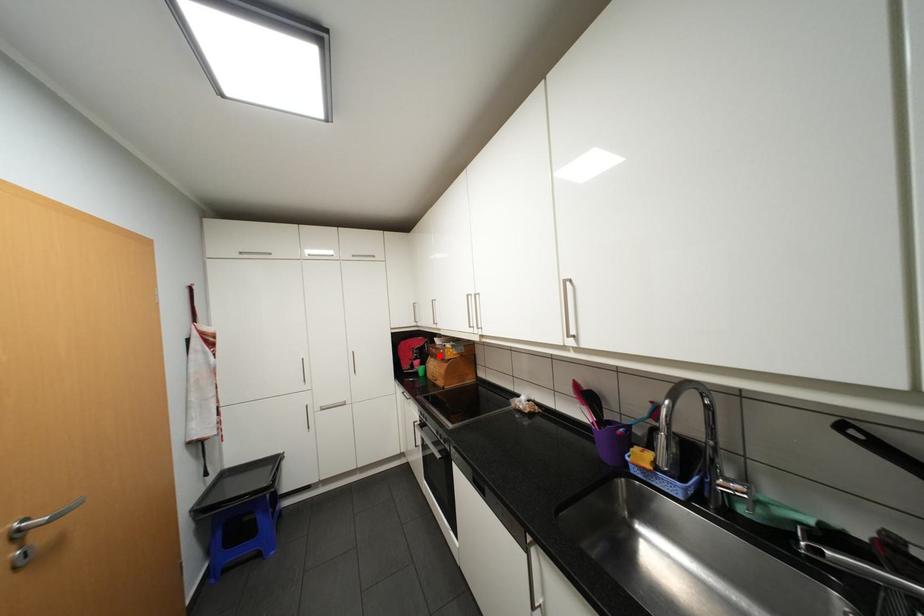
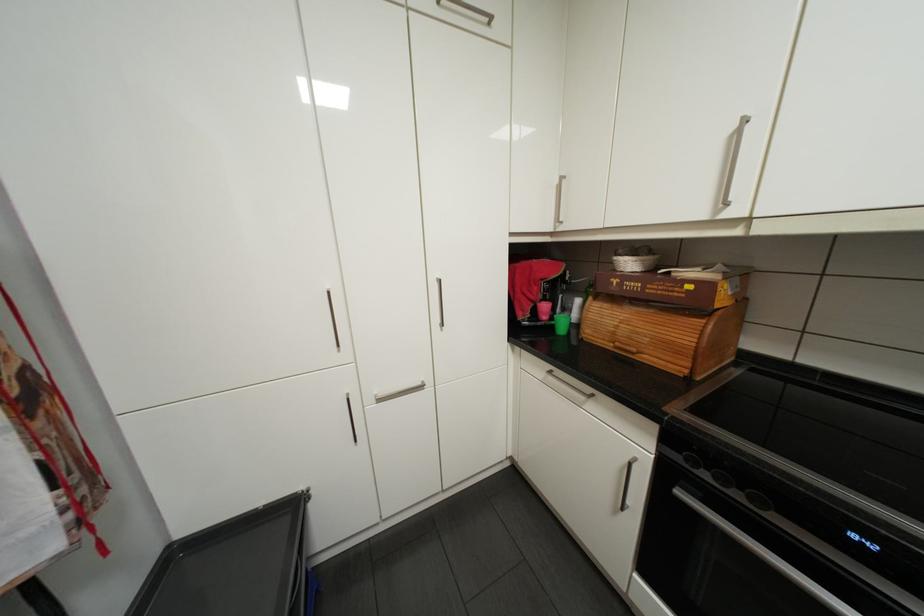
Find the pixel in the second image that matches the highlighted location in the first image.

(602, 297)